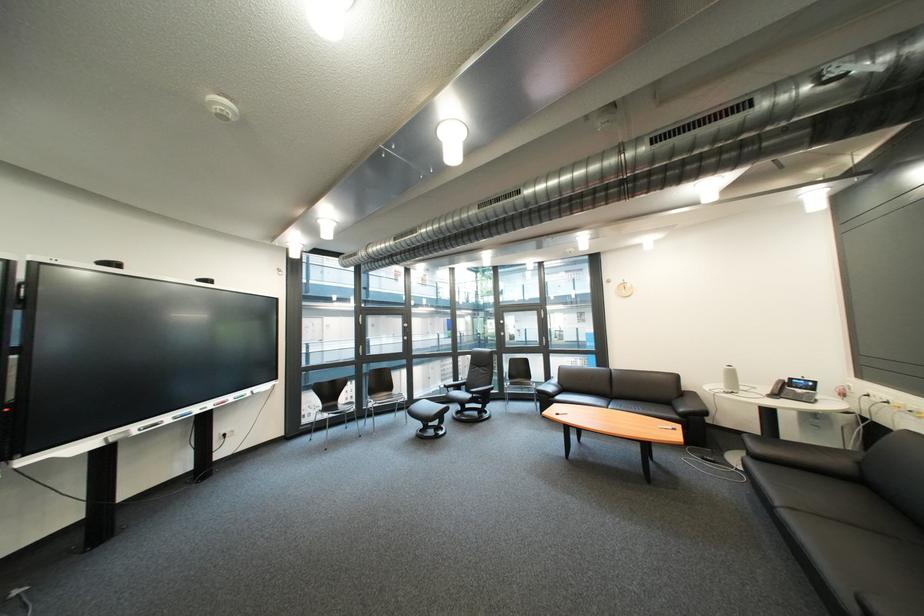
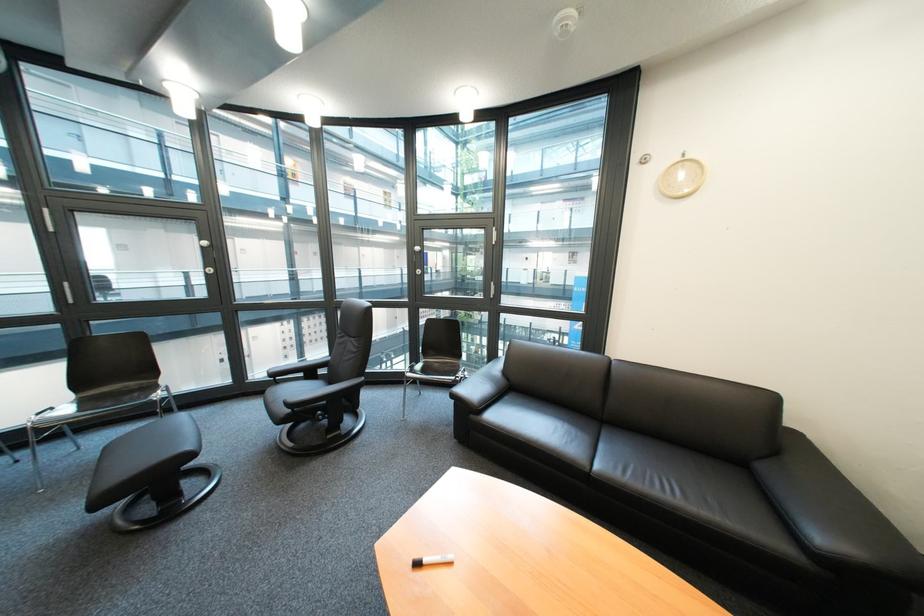
Consider the image. The images are taken continuously from a first-person perspective. In which direction are you moving?

The cameraman walked toward right, forward.